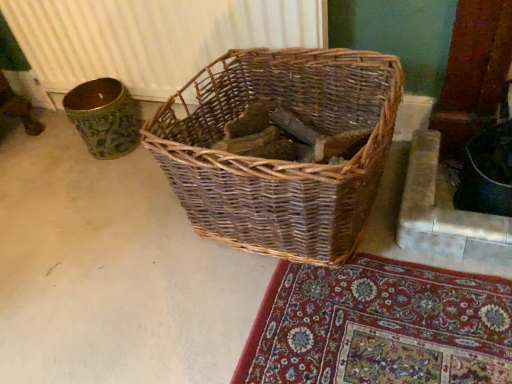
The height and width of the screenshot is (384, 512). Find the location of `woven brown basket at center`. woven brown basket at center is located at coordinates (281, 161).

In order to face woven brown basket at center, should I rotate leftwards or rightwards?

Rotate right and turn 2.993 degrees.

What do you see at coordinates (281, 161) in the screenshot? The image size is (512, 384). I see `woven brown basket at center` at bounding box center [281, 161].

Image resolution: width=512 pixels, height=384 pixels. Describe the element at coordinates (152, 37) in the screenshot. I see `white textured radiator at upper center` at that location.

Image resolution: width=512 pixels, height=384 pixels. I want to click on white textured radiator at upper center, so click(x=152, y=37).

What is the approximate height of white textured radiator at upper center?

16.22 inches.

Where is `woven brown basket at center`? This screenshot has height=384, width=512. woven brown basket at center is located at coordinates (281, 161).

Considering the relative positions of woven brown basket at center and white textured radiator at upper center in the image provided, is woven brown basket at center to the right of white textured radiator at upper center from the viewer's perspective?

Correct, you'll find woven brown basket at center to the right of white textured radiator at upper center.

Is woven brown basket at center further to camera compared to white textured radiator at upper center?

No, it is not.

Is point (384, 98) positioned after point (168, 50)?

No, (384, 98) is closer to viewer.

From the image's perspective, which is below, woven brown basket at center or white textured radiator at upper center?

woven brown basket at center appears lower in the image.

From a real-world perspective, is woven brown basket at center located beneath white textured radiator at upper center?

Yes, from a real-world perspective, woven brown basket at center is under white textured radiator at upper center.

Considering the sizes of woven brown basket at center and white textured radiator at upper center in the image, is woven brown basket at center wider or thinner than white textured radiator at upper center?

Clearly, woven brown basket at center has more width compared to white textured radiator at upper center.

Considering the relative sizes of woven brown basket at center and white textured radiator at upper center in the image provided, is woven brown basket at center shorter than white textured radiator at upper center?

Yes, woven brown basket at center is shorter than white textured radiator at upper center.

In terms of size, does woven brown basket at center appear bigger or smaller than white textured radiator at upper center?

woven brown basket at center is bigger than white textured radiator at upper center.

Is woven brown basket at center completely or partially outside of white textured radiator at upper center?

woven brown basket at center lies outside white textured radiator at upper center's area.

Is woven brown basket at center positioned far away from white textured radiator at upper center?

No, woven brown basket at center is not far away from white textured radiator at upper center.

Does woven brown basket at center turn towards white textured radiator at upper center?

No.

How many degrees apart are the facing directions of woven brown basket at center and white textured radiator at upper center?

woven brown basket at center and white textured radiator at upper center are facing 3.6 degrees away from each other.

I want to click on picnic basket below the white textured radiator at upper center (from the image's perspective), so click(x=281, y=161).

Considering the positions of objects white textured radiator at upper center and woven brown basket at center in the image provided, who is more to the left, white textured radiator at upper center or woven brown basket at center?

white textured radiator at upper center.

Is white textured radiator at upper center in front of or behind woven brown basket at center in the image?

Visually, white textured radiator at upper center is located behind woven brown basket at center.

Between point (106, 34) and point (374, 195), which one is positioned in front?

Positioned in front is point (374, 195).

From the image's perspective, which one is positioned higher, white textured radiator at upper center or woven brown basket at center?

white textured radiator at upper center.

From the picture: From a real-world perspective, is white textured radiator at upper center physically above woven brown basket at center?

Yes, from a real-world perspective, white textured radiator at upper center is over woven brown basket at center

Considering the relative sizes of white textured radiator at upper center and woven brown basket at center in the image provided, is white textured radiator at upper center wider than woven brown basket at center?

No.

Which of these two, white textured radiator at upper center or woven brown basket at center, stands shorter?

With less height is woven brown basket at center.

Is white textured radiator at upper center bigger or smaller than woven brown basket at center?

Clearly, white textured radiator at upper center is smaller in size than woven brown basket at center.

Is white textured radiator at upper center located outside woven brown basket at center?

Yes, white textured radiator at upper center is not within woven brown basket at center.

Is white textured radiator at upper center beside woven brown basket at center?

No, white textured radiator at upper center is not next to woven brown basket at center.

Is white textured radiator at upper center aimed at woven brown basket at center?

Yes, white textured radiator at upper center is turned towards woven brown basket at center.

There is a woven brown basket at center. Where is `radiator above it (from a real-world perspective)`? This screenshot has width=512, height=384. radiator above it (from a real-world perspective) is located at coordinates (152, 37).

Find the location of a particular element. The height and width of the screenshot is (384, 512). picnic basket below the white textured radiator at upper center (from the image's perspective) is located at coordinates (281, 161).

Locate an element on the screen. Image resolution: width=512 pixels, height=384 pixels. picnic basket below the white textured radiator at upper center (from a real-world perspective) is located at coordinates (281, 161).